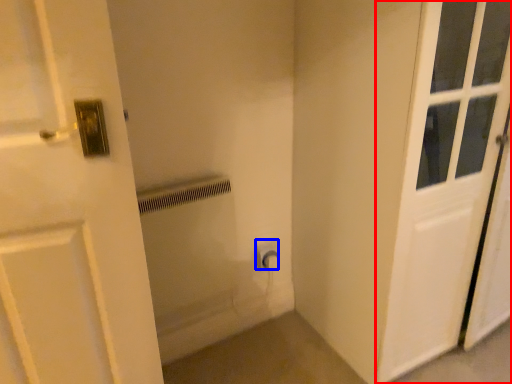
Question: Which of the following is the farthest to the observer, door (highlighted by a red box) or electric outlet (highlighted by a blue box)?

Choices:
 (A) door
 (B) electric outlet

Answer: (B)